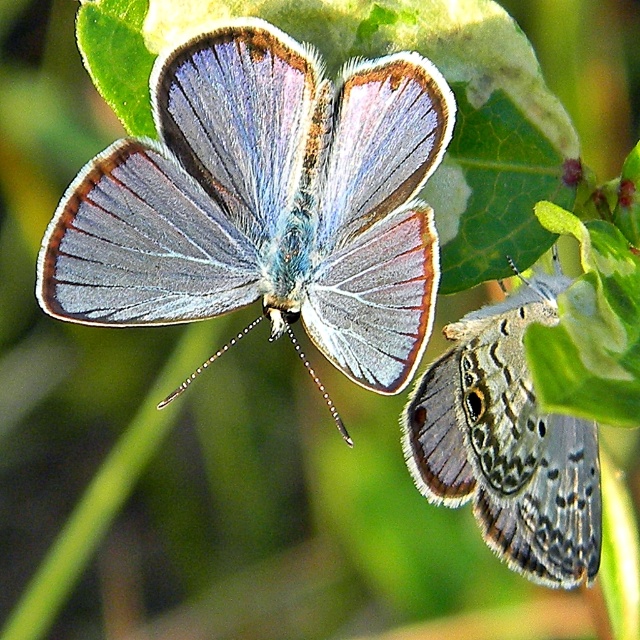
You are an entomologist observing two butterflies on a leafy plant. You notice a specific point at coordinates (266,204). Which butterfly does this point belong to? The first butterfly has light blue wings with a reddish border, while the second has darker wings with black and brown spots. Use the scene description to determine the answer.

The point at coordinates (266,204) is on matte blue wings at center, so it belongs to the first butterfly with light blue wings and a reddish border.

You are a gardener observing two butterflies on a plant. You notice the matte blue wings at center and the translucent gray wings at lower right. Which butterfly is closer to you?

The matte blue wings at center is closer to you because it is positioned over the translucent gray wings at lower right.